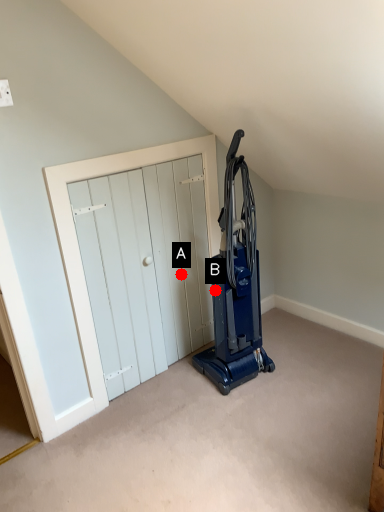
Question: Two points are circled on the image, labeled by A and B beside each circle. Which point appears closest to the camera in this image?

Choices:
 (A) A is closer
 (B) B is closer

Answer: (B)